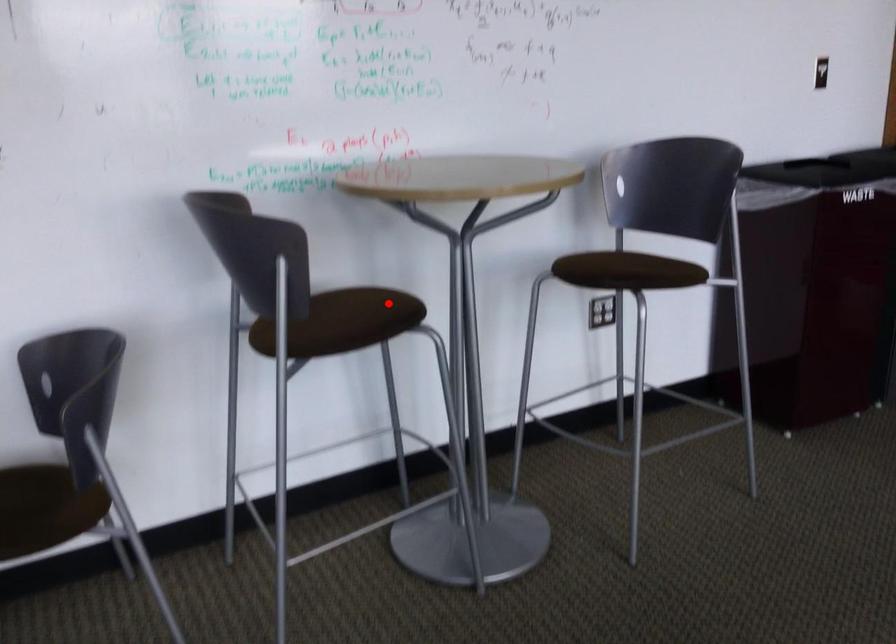
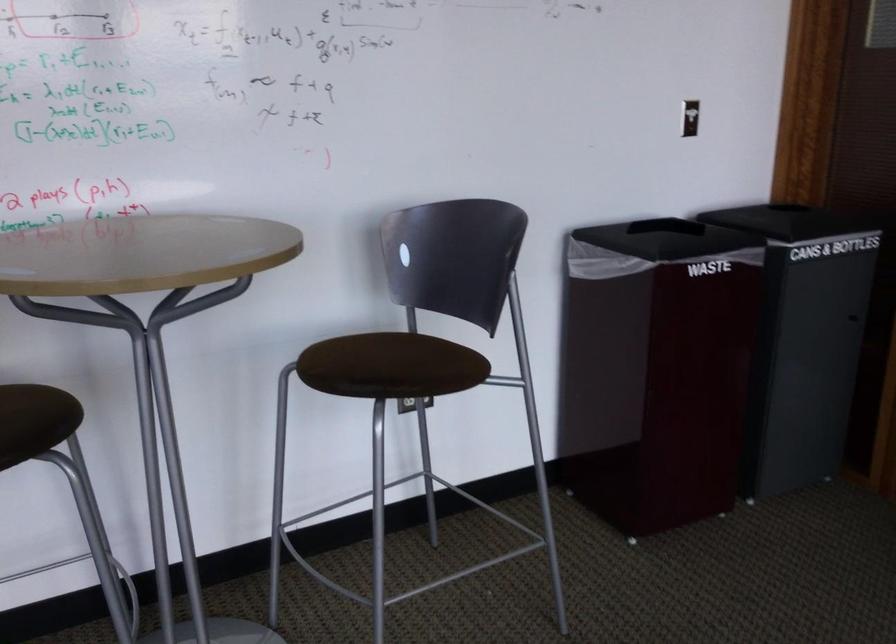
Question: I am providing you with two images of the same scene from different viewpoints. Given a red point in image1, look at the same physical point in image2. Is it:

Choices:
 (A) Closer to the viewpoint
 (B) Farther from the viewpoint

Answer: (A)